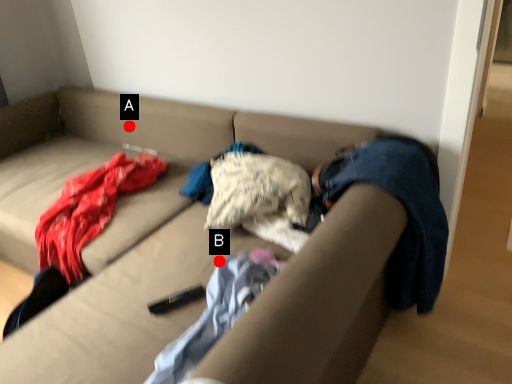
Question: Two points are circled on the image, labeled by A and B beside each circle. Among these points, which one is nearest to the camera?

Choices:
 (A) A is closer
 (B) B is closer

Answer: (B)